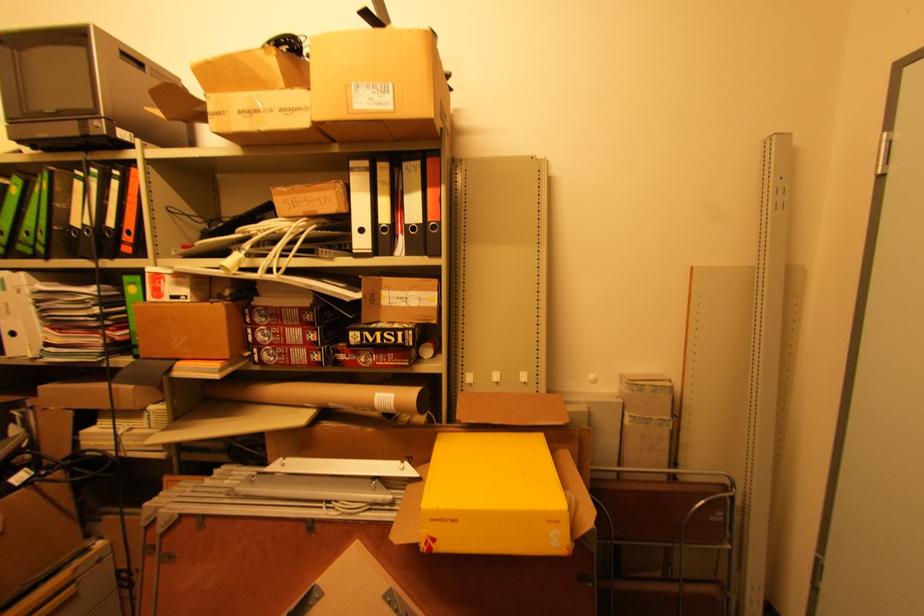
At what (x,y) coordinates should I click in order to perform the action: click on rolled paper tube. Please return your answer as a coordinate pair (x, y). This screenshot has width=924, height=616. Looking at the image, I should click on (324, 395).